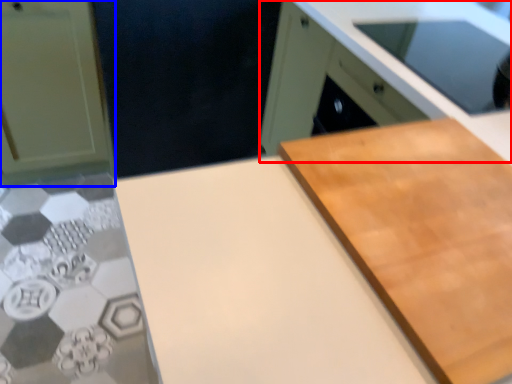
Question: Which point is further to the camera, cabinetry (highlighted by a red box) or cabinetry (highlighted by a blue box)?

Choices:
 (A) cabinetry
 (B) cabinetry

Answer: (B)